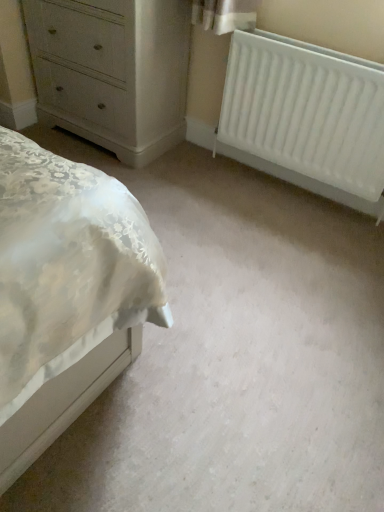
Question: From the image's perspective, is white painted wood chest of drawers at upper left positioned above or below white matte radiator at right?

Choices:
 (A) above
 (B) below

Answer: (A)

Question: Is white painted wood chest of drawers at upper left spatially inside white matte radiator at right, or outside of it?

Choices:
 (A) outside
 (B) inside

Answer: (A)

Question: Looking at the image, does white painted wood chest of drawers at upper left seem bigger or smaller compared to white matte radiator at right?

Choices:
 (A) big
 (B) small

Answer: (A)

Question: In terms of width, does white matte radiator at right look wider or thinner when compared to white painted wood chest of drawers at upper left?

Choices:
 (A) wide
 (B) thin

Answer: (B)

Question: Would you say white matte radiator at right is to the left or to the right of white painted wood chest of drawers at upper left in the picture?

Choices:
 (A) left
 (B) right

Answer: (B)

Question: Based on their sizes in the image, would you say white matte radiator at right is bigger or smaller than white painted wood chest of drawers at upper left?

Choices:
 (A) big
 (B) small

Answer: (B)

Question: Considering the positions of white matte radiator at right and white painted wood chest of drawers at upper left in the image, is white matte radiator at right taller or shorter than white painted wood chest of drawers at upper left?

Choices:
 (A) tall
 (B) short

Answer: (B)